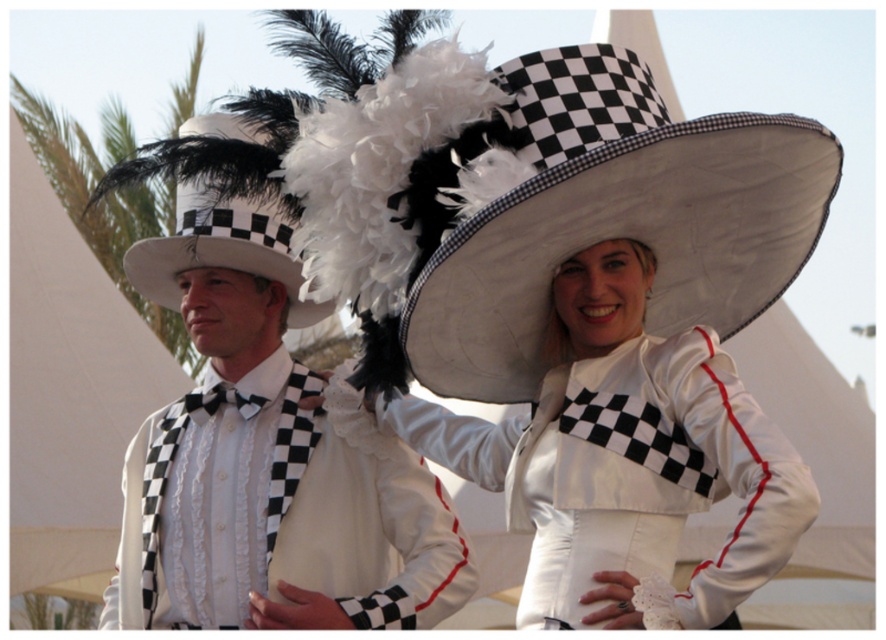
Question: From the image, what is the correct spatial relationship of matte black bow tie at left in relation to satin white hat at upper center?

Choices:
 (A) right
 (B) left

Answer: (B)

Question: Estimate the real-world distances between objects in this image. Which object is closer to the white matte cowboy hat at center?

Choices:
 (A) matte black bow tie at left
 (B) matte black and white checkered cowboy hat at left

Answer: (A)

Question: Which of the following is the farthest from the observer?

Choices:
 (A) matte black and white checkered cowboy hat at left
 (B) white matte cowboy hat at center
 (C) matte black bow tie at left

Answer: (A)

Question: Which point appears closest to the camera in this image?

Choices:
 (A) (180, 296)
 (B) (574, 140)
 (C) (696, 452)
 (D) (196, 508)

Answer: (B)

Question: Is matte black bow tie at left positioned behind matte black and white checkered cowboy hat at left?

Choices:
 (A) yes
 (B) no

Answer: (B)

Question: Where is satin white hat at upper center located in relation to matte black and white checkered cowboy hat at left in the image?

Choices:
 (A) above
 (B) below

Answer: (B)